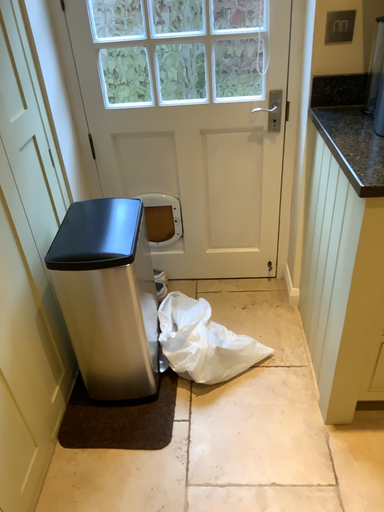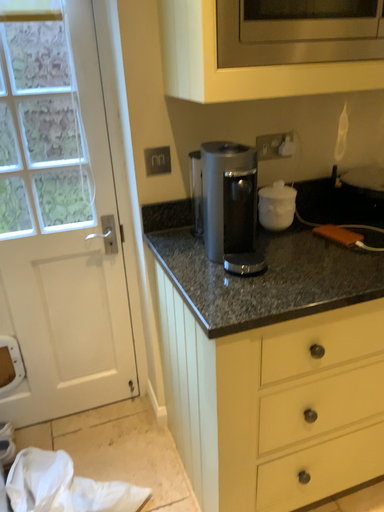
Question: How did the camera likely rotate when shooting the video?

Choices:
 (A) rotated upward
 (B) rotated downward

Answer: (A)